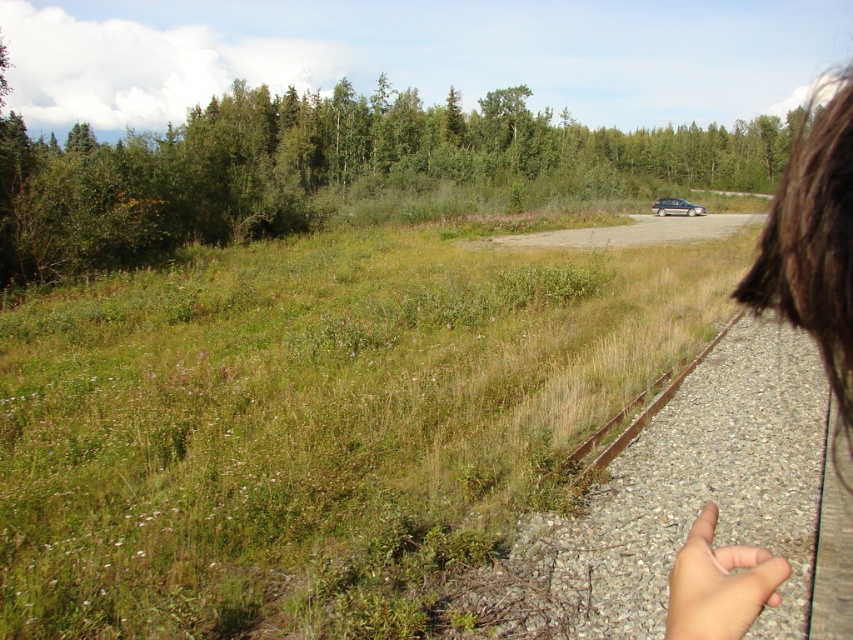
You are standing at the bottom right corner of the image and want to walk towards the brown hair at upper right. Which direction should you go relative to the green leafy tree at upper center?

You should head to the right of the green leafy tree at upper center because the brown hair at upper right is located to the right of it.

You are standing at the bottom right corner of the image and want to walk towards the clear glass window at center. Which direction should you walk relative to the green leafy tree at upper center?

You should walk to the right side of the green leafy tree at upper center to reach the clear glass window at center because the tree is on the left side of the window.

You are standing at the point with coordinates point (668, 196) and want to walk towards the point (692, 538). Which direction should you move?

Since point (692, 538) is closer to the camera than point (668, 196), you should move towards the direction of the camera to reach point (692, 538).